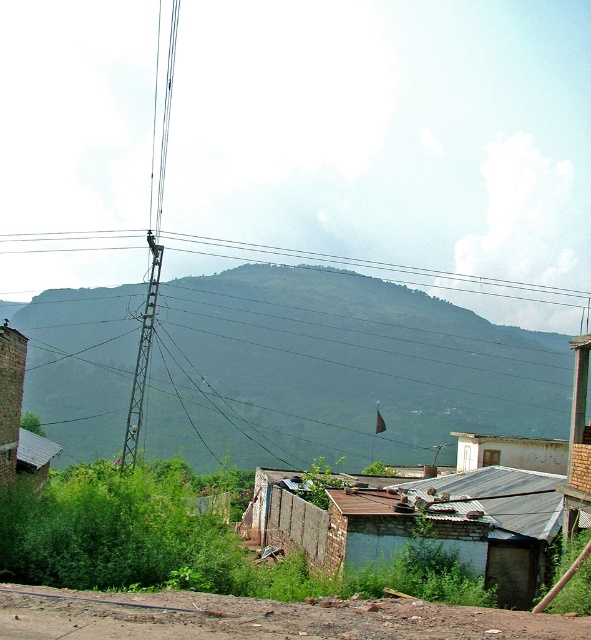
You are standing at the point closer to the camera between the two points, point [27,243] and point [142,355]. Which point are you standing at?

You are standing at point [27,243] because it is further to the camera than point [142,355].